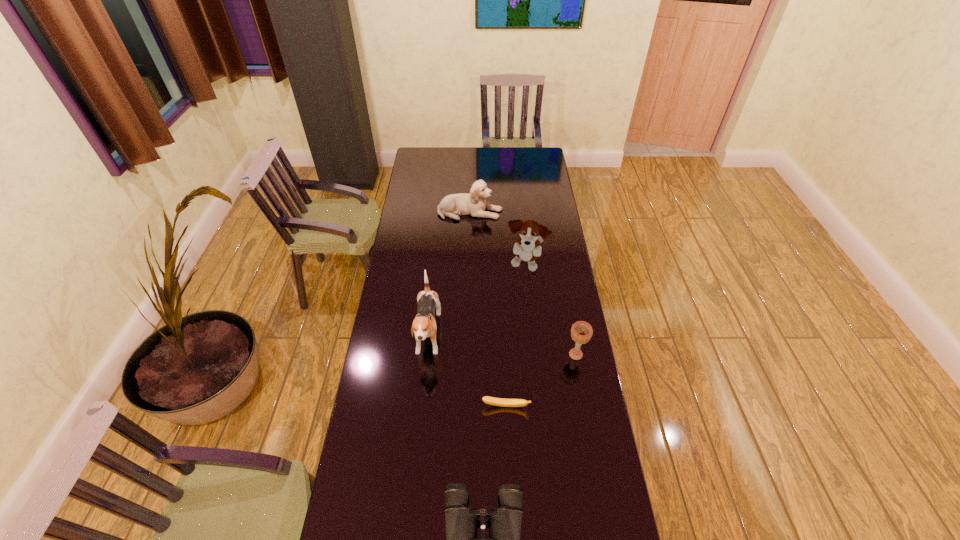
Where is `vacant space located 0.310m on the back of the chalice`? vacant space located 0.310m on the back of the chalice is located at coordinates (564, 287).

Locate an element on the screen. This screenshot has height=540, width=960. free point located at the stem of the banana is located at coordinates (508, 458).

Where is `object that is positioned at the left edge`? The width and height of the screenshot is (960, 540). object that is positioned at the left edge is located at coordinates (424, 325).

Identify the location of puppy that is at the right edge. (527, 248).

Locate an element on the screen. This screenshot has height=540, width=960. chalice located in the right edge section of the desktop is located at coordinates [581, 332].

Where is `vacant space at the left edge of the desktop`? This screenshot has height=540, width=960. vacant space at the left edge of the desktop is located at coordinates (424, 190).

The image size is (960, 540). Identify the location of vacant space at the right edge of the desktop. (564, 447).

Locate an element on the screen. vacant space at the far left corner of the desktop is located at coordinates click(425, 153).

The height and width of the screenshot is (540, 960). I want to click on vacant point located between the farthest object and the nearest puppy, so click(x=449, y=275).

Find the location of `unoccupied position between the chalice and the second nearest puppy`. unoccupied position between the chalice and the second nearest puppy is located at coordinates (551, 310).